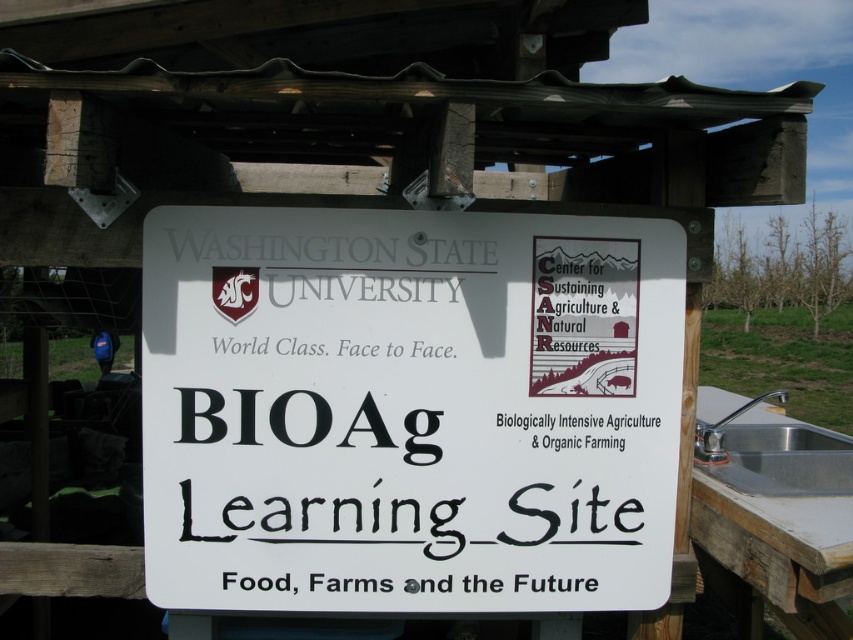
Question: Which point appears farthest from the camera in this image?

Choices:
 (A) (717, 445)
 (B) (527, 365)

Answer: (A)

Question: Does white plastic sign at center come behind silver metallic sink at right?

Choices:
 (A) yes
 (B) no

Answer: (B)

Question: Among these points, which one is farthest from the camera?

Choices:
 (A) (x=776, y=492)
 (B) (x=247, y=508)

Answer: (A)

Question: Is the position of white plastic sign at center more distant than that of silver metallic sink at right?

Choices:
 (A) no
 (B) yes

Answer: (A)

Question: Does white plastic sign at center have a smaller size compared to silver metallic sink at right?

Choices:
 (A) no
 (B) yes

Answer: (B)